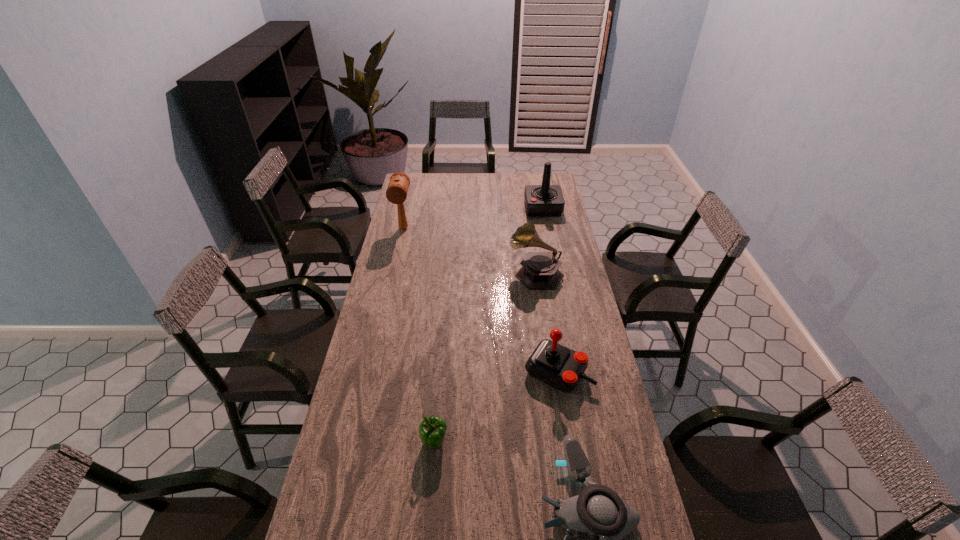
At what (x,y) coordinates should I click in order to perform the action: click on free location at the left edge. Please return your answer as a coordinate pair (x, y). Looking at the image, I should click on (403, 242).

The height and width of the screenshot is (540, 960). What are the coordinates of `free space at the right edge` in the screenshot? It's located at (621, 490).

The image size is (960, 540). I want to click on free spot between the phonograph record and the bell pepper, so click(485, 359).

Locate an element on the screen. The height and width of the screenshot is (540, 960). free space between the phonograph record and the fifth object from right to left is located at coordinates (485, 359).

Find the location of `free spot between the nearer joystick and the mallet`. free spot between the nearer joystick and the mallet is located at coordinates (481, 300).

In order to click on free spot between the bell pepper and the phonograph record in this screenshot , I will do `click(485, 359)`.

You are a GUI agent. You are given a task and a screenshot of the screen. Output one action in this format:
    pyautogui.click(x=<x>, y=<y>)
    Task: Click on the free spot between the second object from left to right and the fifth nearest object
    This screenshot has height=540, width=960.
    Given the screenshot: What is the action you would take?
    pyautogui.click(x=419, y=336)

This screenshot has height=540, width=960. I want to click on free spot between the fourth farthest object and the third farthest object, so click(x=547, y=322).

I want to click on vacant area between the leftmost object and the fourth farthest object, so click(x=481, y=300).

At what (x,y) coordinates should I click in order to perform the action: click on object that can be found as the closest to the shortest object. Please return your answer as a coordinate pair (x, y). Looking at the image, I should click on (554, 364).